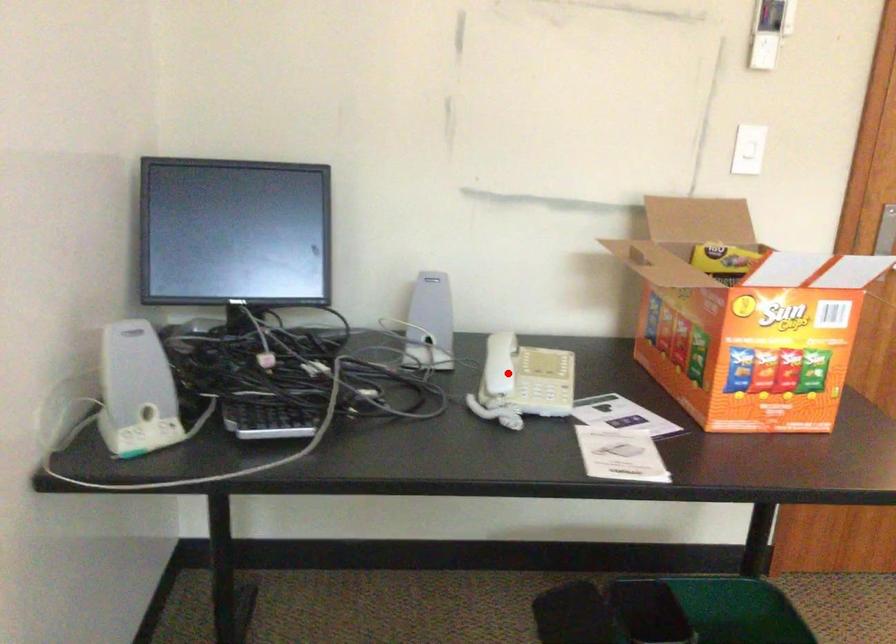
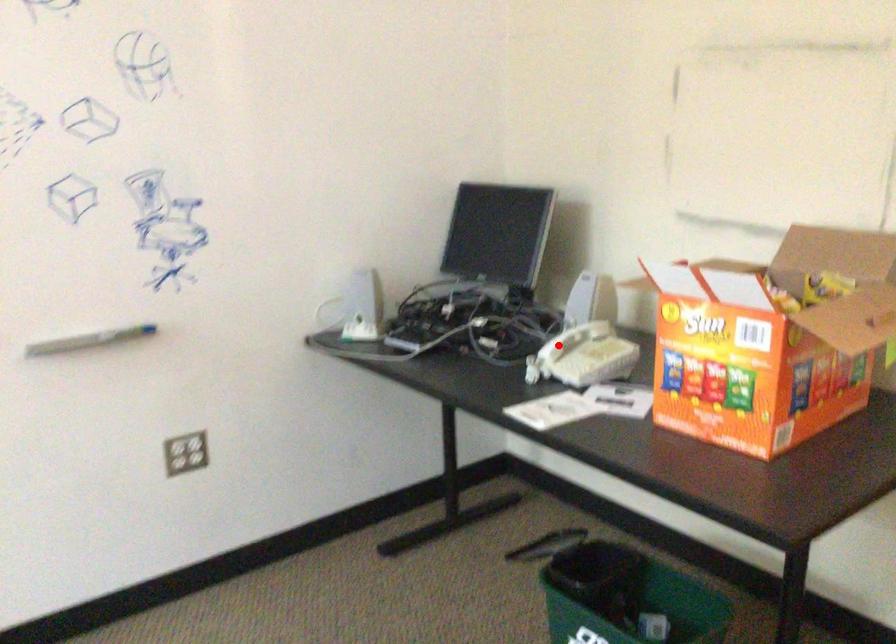
I am providing you with two images of the same scene from different viewpoints. A red point is marked on the first image and another point is marked on the second image. Are the points marked in image1 and image2 representing the same 3D position?

Yes